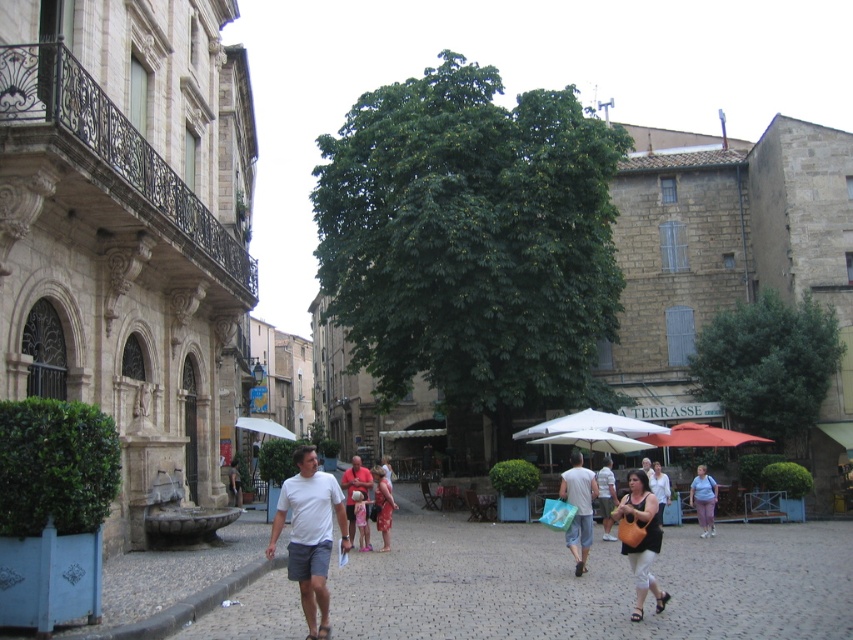
Question: Which point is farther to the camera?

Choices:
 (A) (647, 516)
 (B) (292, 570)
 (C) (355, 477)

Answer: (C)

Question: Which object is farther from the camera taking this photo?

Choices:
 (A) white cotton t-shirt at center
 (B) white cotton shirt at center
 (C) white fabric umbrella at center

Answer: (C)

Question: Is black leather handbag at center behind light beige shorts at center?

Choices:
 (A) no
 (B) yes

Answer: (A)

Question: Can you confirm if white cotton t-shirt at center is positioned below matte pink dress at center?

Choices:
 (A) no
 (B) yes

Answer: (A)

Question: Is light beige shorts at center to the right of light brown leather jacket at center from the viewer's perspective?

Choices:
 (A) yes
 (B) no

Answer: (A)

Question: Which point is farther from the camera taking this photo?

Choices:
 (A) (631, 554)
 (B) (665, 500)
 (C) (363, 545)

Answer: (B)